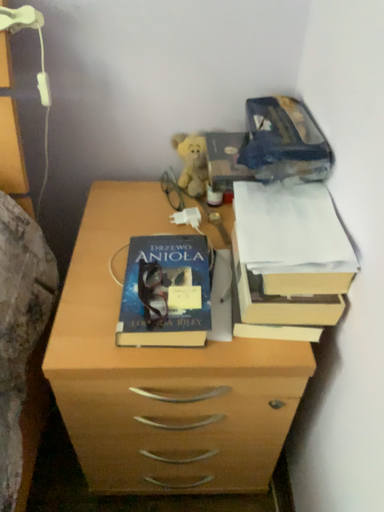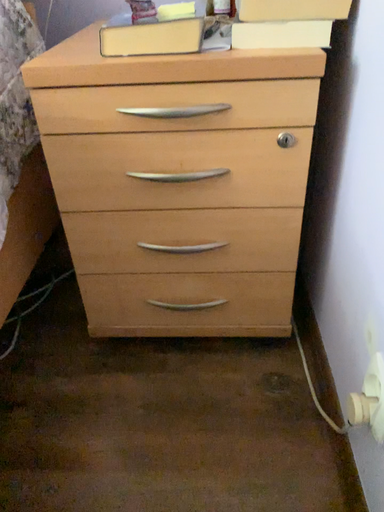
Question: How did the camera likely rotate when shooting the video?

Choices:
 (A) rotated downward
 (B) rotated upward

Answer: (B)